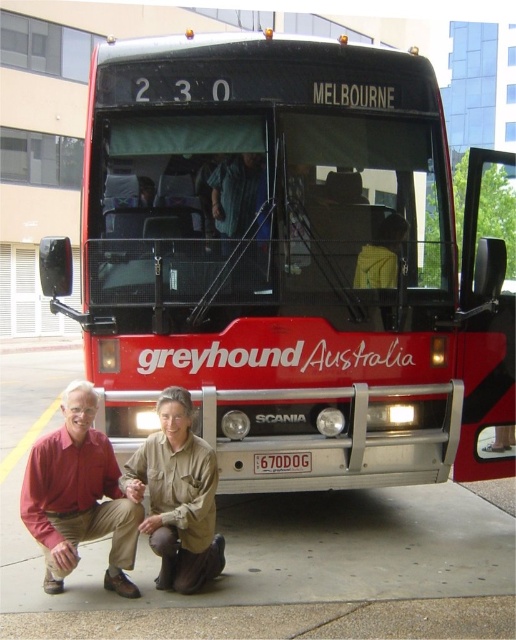
Does metallic red bus at center have a lesser width compared to brown leather jacket at lower center?

No, metallic red bus at center is not thinner than brown leather jacket at lower center.

Does metallic red bus at center have a larger size compared to brown leather jacket at lower center?

Indeed, metallic red bus at center has a larger size compared to brown leather jacket at lower center.

At what (x,y) coordinates should I click in order to perform the action: click on metallic red bus at center. Please return your answer as a coordinate pair (x, y). This screenshot has width=516, height=640. Looking at the image, I should click on (289, 262).

Is metallic red bus at center wider than matte red shirt at lower left?

Correct, the width of metallic red bus at center exceeds that of matte red shirt at lower left.

Does metallic red bus at center have a lesser height compared to matte red shirt at lower left?

No.

At what (x,y) coordinates should I click in order to perform the action: click on metallic red bus at center. Please return your answer as a coordinate pair (x, y). Image resolution: width=516 pixels, height=640 pixels. Looking at the image, I should click on (289, 262).

This screenshot has width=516, height=640. Find the location of `metallic red bus at center`. metallic red bus at center is located at coordinates (289, 262).

Which is behind, point (349, 529) or point (201, 524)?

The point (349, 529) is more distant.

Consider the image. Between gray concrete pavement at lower center and brown leather jacket at lower center, which one has more height?

With more height is brown leather jacket at lower center.

Is point (388, 497) positioned behind point (157, 490)?

That is True.

Identify the location of gray concrete pavement at lower center. coord(266,552).